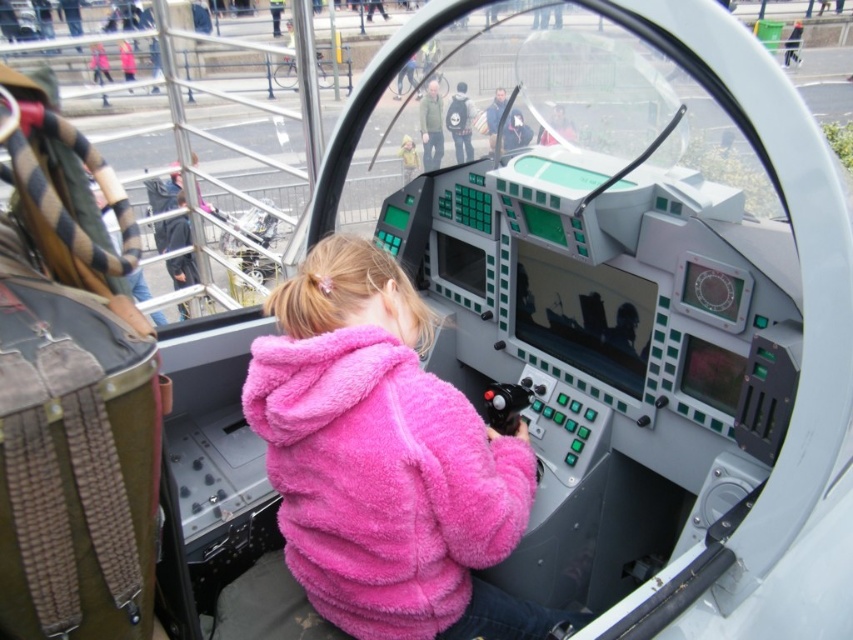
You are a visitor at a sci fi exhibit. You see a fuzzy pink jacket at center and a matte black helmet at upper center. Which object is positioned to the right side?

The matte black helmet at upper center is positioned to the right of the fuzzy pink jacket at center.

You are standing at the center of the bridge and see the point marked at coordinates (431,125). What object is located at that point?

The point at coordinates (431,125) indicates the green matte jacket at upper center.